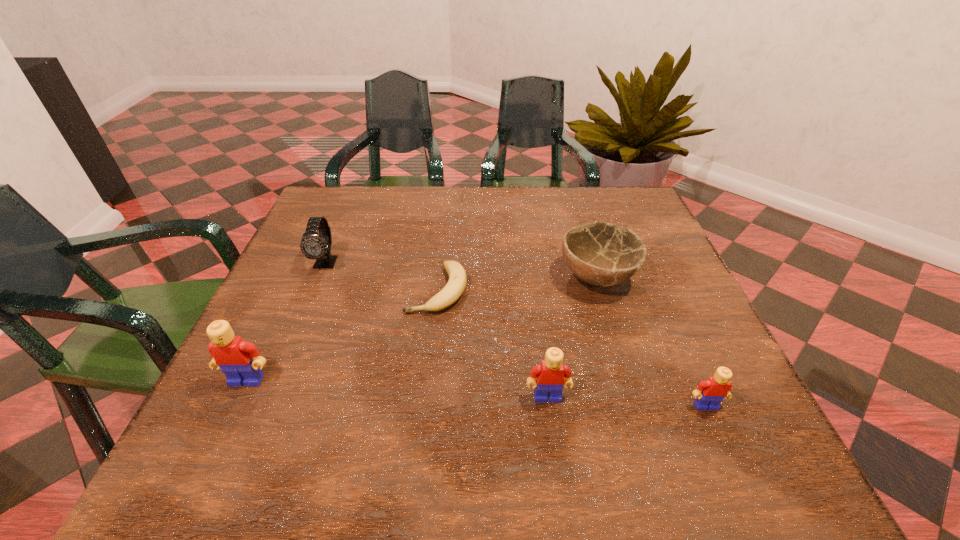
Locate an element on the screen. The height and width of the screenshot is (540, 960). vacant area that lies between the fourth object from right to left and the tallest Lego is located at coordinates (342, 335).

Where is `free point between the second shortest Lego and the shortest object`? The height and width of the screenshot is (540, 960). free point between the second shortest Lego and the shortest object is located at coordinates (492, 343).

Locate an element on the screen. This screenshot has width=960, height=540. unoccupied position between the tallest object and the watch is located at coordinates (286, 321).

Where is `free space between the third object from right to left and the third nearest object`? The image size is (960, 540). free space between the third object from right to left and the third nearest object is located at coordinates (397, 389).

Identify the location of vacant space that is in between the banana and the bowl. coord(517,284).

What are the coordinates of `the fifth closest object relative to the shortest Lego` in the screenshot? It's located at (314, 245).

Identify which object is the second closest to the bowl. Please provide its 2D coordinates. Your answer should be formatted as a tuple, i.e. [(x, y)], where the tuple contains the x and y coordinates of a point satisfying the conditions above.

[(550, 374)]

Locate which Lego ranks in proximity to the shortest object. Please provide its 2D coordinates. Your answer should be formatted as a tuple, i.e. [(x, y)], where the tuple contains the x and y coordinates of a point satisfying the conditions above.

[(550, 374)]

The width and height of the screenshot is (960, 540). In order to click on Lego that is the second nearest to the bowl in this screenshot , I will do `click(716, 388)`.

Locate an element on the screen. This screenshot has height=540, width=960. vacant region that satisfies the following two spatial constraints: 1. on the face of the second object from right to left; 2. on the left side of the watch is located at coordinates (320, 278).